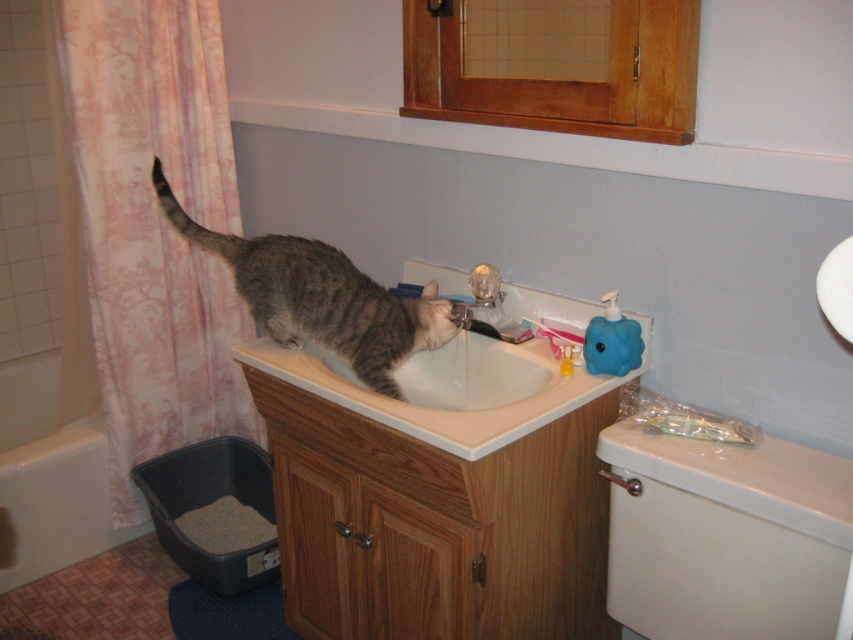
Question: Estimate the real-world distances between objects in this image. Which object is farther from the gray tabby cat at sink?

Choices:
 (A) white glossy bathtub at lower left
 (B) white plastic toilet at lower right
 (C) white glossy sink at center
 (D) matte silver faucet at sink center

Answer: (A)

Question: Which object is farther from the camera taking this photo?

Choices:
 (A) white glossy sink at center
 (B) white glossy bathtub at lower left
 (C) gray tabby cat at sink

Answer: (B)

Question: Which of the following is the closest to the observer?

Choices:
 (A) (395, 349)
 (B) (48, 513)
 (C) (519, 420)

Answer: (C)

Question: From the image, what is the correct spatial relationship of white glossy sink at center in relation to white glossy bathtub at lower left?

Choices:
 (A) above
 (B) below

Answer: (A)

Question: Is gray tabby cat at sink below matte silver faucet at sink center?

Choices:
 (A) yes
 (B) no

Answer: (B)

Question: Observing the image, what is the correct spatial positioning of pink floral fabric curtain at left in reference to white plastic toilet at lower right?

Choices:
 (A) right
 (B) left

Answer: (B)